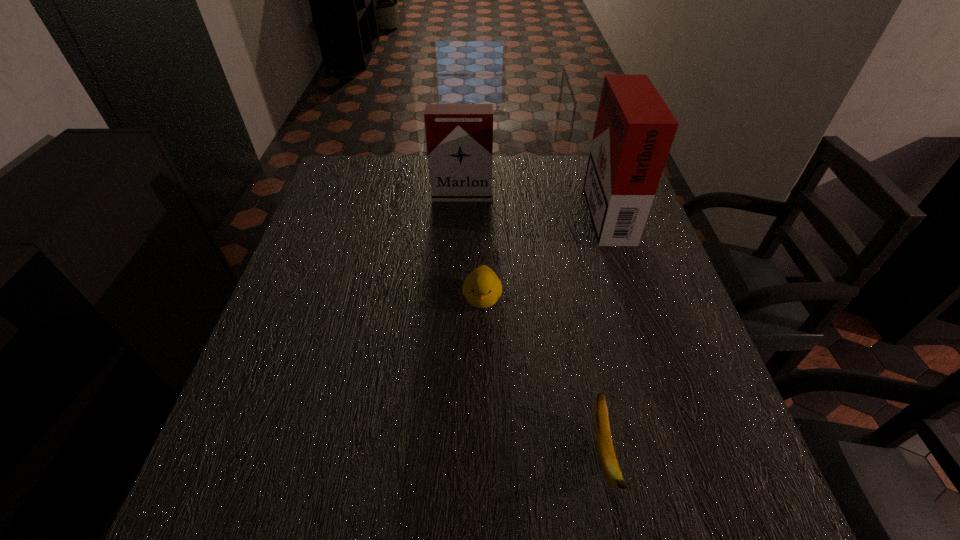
This screenshot has height=540, width=960. In the image, there is a desktop. Find the location of `vacant area at the far left corner`. vacant area at the far left corner is located at coordinates (362, 179).

The image size is (960, 540). I want to click on vacant space at the near left corner, so click(215, 475).

Where is `free spot between the duck and the shorter cigarette_case`? free spot between the duck and the shorter cigarette_case is located at coordinates (472, 247).

Image resolution: width=960 pixels, height=540 pixels. Identify the location of free spot between the tallest object and the third object from left to right. (x=605, y=332).

The width and height of the screenshot is (960, 540). I want to click on empty space that is in between the shortest object and the taller cigarette_case, so click(605, 332).

Identify the location of empty location between the shortest object and the third shortest object. The height and width of the screenshot is (540, 960). (533, 325).

The height and width of the screenshot is (540, 960). Identify the location of free area in between the second tallest object and the taller cigarette_case. (534, 202).

Where is `empty space that is in between the shorter cigarette_case and the second shortest object`? empty space that is in between the shorter cigarette_case and the second shortest object is located at coordinates (472, 247).

This screenshot has width=960, height=540. Identify the location of free point between the tallest object and the shorter cigarette_case. (534, 202).

Identify the location of vacant point located between the left cigarette_case and the third tallest object. (472, 247).